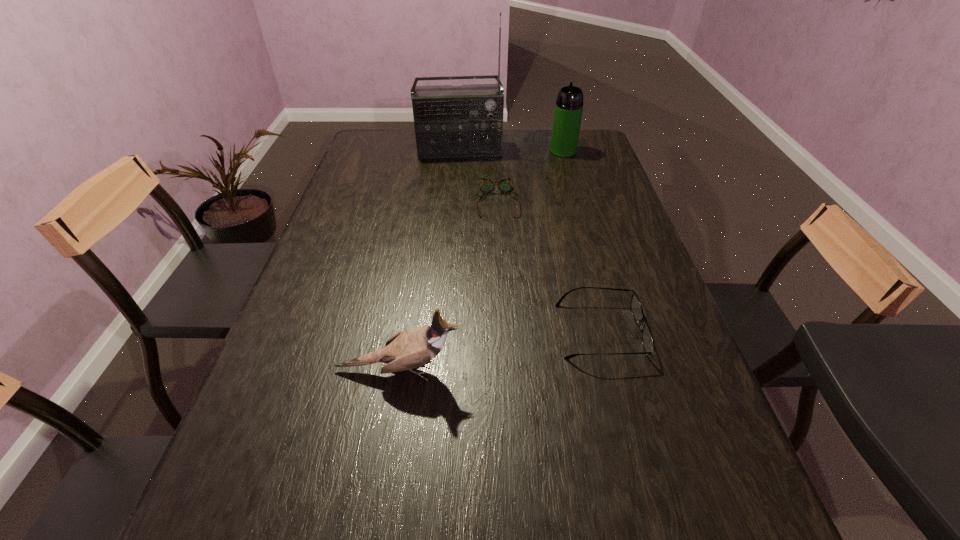
Identify the location of vacant point located between the right spectacles and the radio receiver. The image size is (960, 540). (530, 241).

Find the location of a particular element. The width and height of the screenshot is (960, 540). free point between the third tallest object and the tallest object is located at coordinates (429, 260).

Find the location of a particular element. vacant space that is in between the third farthest object and the right spectacles is located at coordinates 548,265.

Find the location of `free spot between the second tallest object and the radio receiver`. free spot between the second tallest object and the radio receiver is located at coordinates (512, 151).

Where is `vacant area between the radio receiver and the second tallest object`? The width and height of the screenshot is (960, 540). vacant area between the radio receiver and the second tallest object is located at coordinates (512, 151).

Find the location of a particular element. The image size is (960, 540). empty space between the left spectacles and the fourth shortest object is located at coordinates (530, 176).

Identify the location of free space between the right spectacles and the third shortest object. (499, 350).

Find the location of a particular element. This screenshot has height=540, width=960. vacant area between the thermos bottle and the third farthest object is located at coordinates (530, 176).

Locate an element on the screen. Image resolution: width=960 pixels, height=540 pixels. blank region between the farther spectacles and the right spectacles is located at coordinates (548, 265).

Select which object is the fourth closest to the third nearest object. Please provide its 2D coordinates. Your answer should be formatted as a tuple, i.e. [(x, y)], where the tuple contains the x and y coordinates of a point satisfying the conditions above.

[(408, 349)]